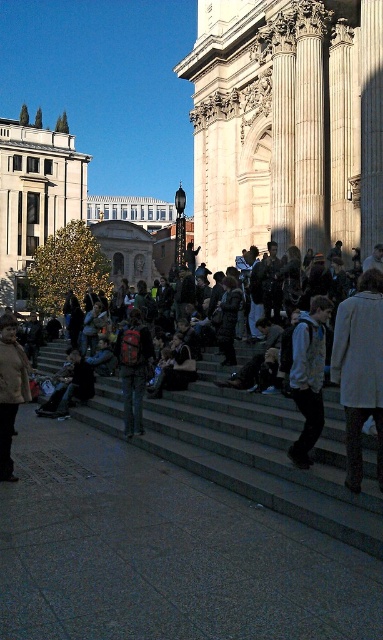
Question: From the image, what is the correct spatial relationship of light blue denim jacket at center in relation to red backpack at center?

Choices:
 (A) right
 (B) left

Answer: (A)

Question: Which object appears closest to the camera in this image?

Choices:
 (A) concrete stairs at center
 (B) red backpack at center

Answer: (A)

Question: Which of the following is the closest to the observer?

Choices:
 (A) red backpack at center
 (B) concrete stairs at center
 (C) matte brown coat at lower left
 (D) light gray coat at center

Answer: (B)

Question: Can you confirm if light gray coat at center is positioned below matte brown coat at lower left?

Choices:
 (A) yes
 (B) no

Answer: (B)

Question: From the image, what is the correct spatial relationship of light gray coat at center in relation to light blue denim jacket at center?

Choices:
 (A) left
 (B) right

Answer: (B)

Question: Which point is farther to the camera?

Choices:
 (A) red backpack at center
 (B) concrete stairs at center
 (C) light blue denim jacket at center
 (D) light gray coat at center

Answer: (A)